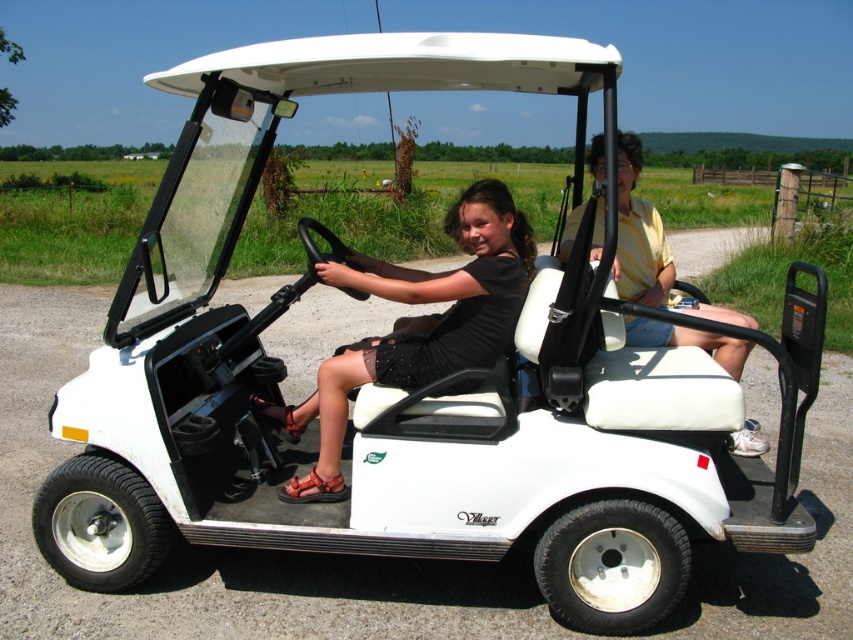
Describe the element at coordinates (416, 324) in the screenshot. I see `black matte dress at center` at that location.

Does black matte dress at center have a larger size compared to white leather seat at center?

No, black matte dress at center is not bigger than white leather seat at center.

Is point (328, 474) more distant than point (630, 269)?

No.

I want to click on black matte dress at center, so click(x=416, y=324).